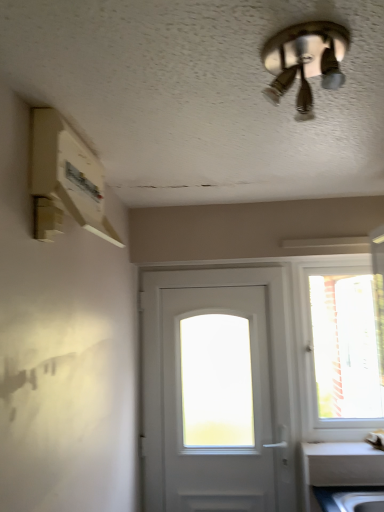
Question: Considering the relative sizes of metallic silver ceiling fan at upper center and transparent glass window at right in the image provided, is metallic silver ceiling fan at upper center shorter than transparent glass window at right?

Choices:
 (A) yes
 (B) no

Answer: (A)

Question: Is metallic silver ceiling fan at upper center facing away from transparent glass window at right?

Choices:
 (A) yes
 (B) no

Answer: (B)

Question: Is metallic silver ceiling fan at upper center thinner than transparent glass window at right?

Choices:
 (A) yes
 (B) no

Answer: (B)

Question: From the image's perspective, is metallic silver ceiling fan at upper center located above transparent glass window at right?

Choices:
 (A) no
 (B) yes

Answer: (B)

Question: Is metallic silver ceiling fan at upper center far from transparent glass window at right?

Choices:
 (A) no
 (B) yes

Answer: (B)

Question: From the image's perspective, relative to transparent glass window at right, is white matte door at center above or below?

Choices:
 (A) above
 (B) below

Answer: (B)

Question: From a real-world perspective, is white matte door at center above or below transparent glass window at right?

Choices:
 (A) below
 (B) above

Answer: (A)

Question: Considering the positions of white matte door at center and transparent glass window at right in the image, is white matte door at center taller or shorter than transparent glass window at right?

Choices:
 (A) short
 (B) tall

Answer: (B)

Question: Visually, is white matte door at center positioned to the left or to the right of transparent glass window at right?

Choices:
 (A) right
 (B) left

Answer: (B)

Question: From the image's perspective, is white matte door at center above or below metallic silver ceiling fan at upper center?

Choices:
 (A) above
 (B) below

Answer: (B)

Question: Is white matte door at center wider or thinner than metallic silver ceiling fan at upper center?

Choices:
 (A) thin
 (B) wide

Answer: (A)

Question: Is white matte door at center bigger or smaller than metallic silver ceiling fan at upper center?

Choices:
 (A) small
 (B) big

Answer: (B)

Question: From a real-world perspective, is white matte door at center positioned above or below metallic silver ceiling fan at upper center?

Choices:
 (A) above
 (B) below

Answer: (B)

Question: Considering the relative positions of transparent glass window at right and white matte door at center in the image provided, is transparent glass window at right to the left or to the right of white matte door at center?

Choices:
 (A) right
 (B) left

Answer: (A)

Question: Is transparent glass window at right inside the boundaries of white matte door at center, or outside?

Choices:
 (A) outside
 (B) inside

Answer: (A)